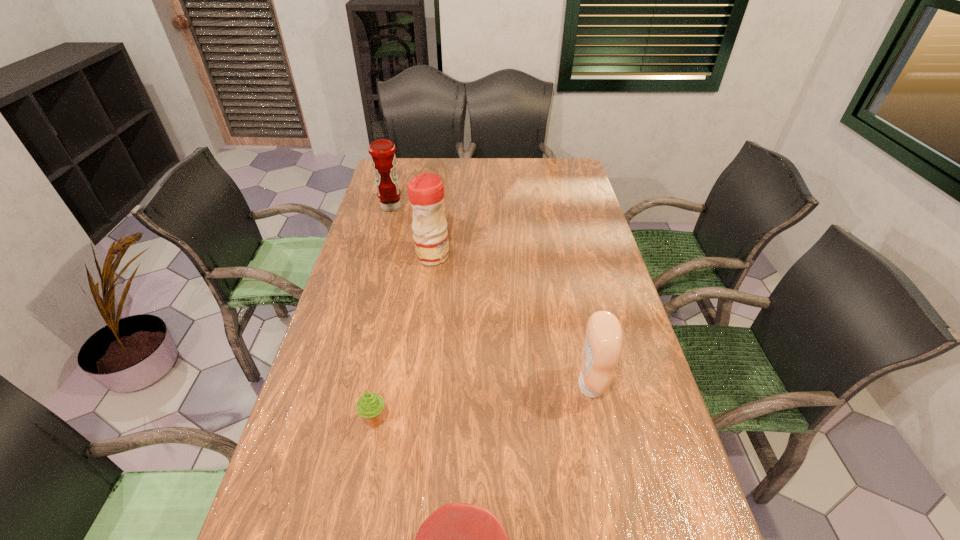
At what (x,y) coordinates should I click in order to perform the action: click on free location located 0.200m on the label of the rightmost condiment. Please return your answer as a coordinate pair (x, y). This screenshot has width=960, height=540. Looking at the image, I should click on (496, 386).

Where is `vacant space located 0.380m on the label of the rightmost condiment`? This screenshot has width=960, height=540. vacant space located 0.380m on the label of the rightmost condiment is located at coordinates click(x=425, y=386).

Find the location of a particular element. vacant space situated 0.370m on the label of the rightmost condiment is located at coordinates (429, 386).

Where is `vacant area situated 0.220m on the back of the second shortest object`? Image resolution: width=960 pixels, height=540 pixels. vacant area situated 0.220m on the back of the second shortest object is located at coordinates (392, 339).

At what (x,y) coordinates should I click in order to perform the action: click on condiment that is at the left edge. Please return your answer as a coordinate pair (x, y). This screenshot has height=540, width=960. Looking at the image, I should click on (382, 151).

I want to click on icecream that is at the left edge, so click(x=370, y=405).

Identify the location of object at the right edge. (602, 348).

Where is `free region at the far edge of the desktop`? free region at the far edge of the desktop is located at coordinates (523, 172).

In the image, there is a desktop. At what (x,y) coordinates should I click in order to perform the action: click on vacant area at the left edge. Please return your answer as a coordinate pair (x, y). Looking at the image, I should click on (298, 465).

The width and height of the screenshot is (960, 540). In the image, there is a desktop. Find the location of `vacant area at the right edge`. vacant area at the right edge is located at coordinates (666, 427).